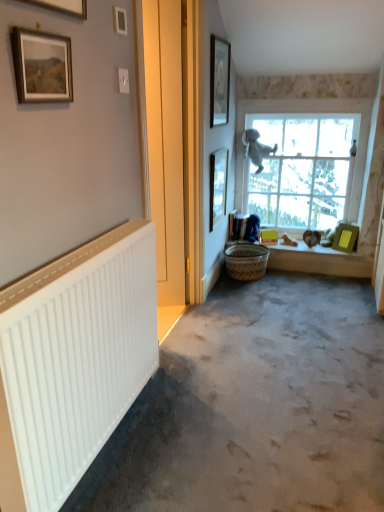
What do you see at coordinates (345, 237) in the screenshot? I see `green matte picture frame at right, which is counted as the sixth picture frame, starting from the front` at bounding box center [345, 237].

Describe the element at coordinates (64, 6) in the screenshot. I see `matte gold picture frame at upper left, marked as the first picture frame in a front-to-back arrangement` at that location.

What is the approximate height of matte gold picture frame at upper left, which ranks as the 1th picture frame in left-to-right order?

It is 11.10 inches.

Describe the element at coordinates (218, 185) in the screenshot. This screenshot has width=384, height=512. I see `matte black picture frame at right, which is the 5th picture frame from left to right` at that location.

From the picture: What is the approximate width of matte wooden picture frame at upper center, the 4th picture frame positioned from the front?

matte wooden picture frame at upper center, the 4th picture frame positioned from the front, is 0.93 inches in width.

Locate an element on the screen. Image resolution: width=384 pixels, height=512 pixels. white matte radiator at left is located at coordinates (255, 406).

Is wooden framed painting at upper left, which ranks as the fifth picture frame in right-to-left order, further to the viewer compared to matte wooden picture frame at upper center, which is the third picture frame from right to left?

No, wooden framed painting at upper left, which ranks as the fifth picture frame in right-to-left order, is closer to the camera.

From the image's perspective, would you say wooden framed painting at upper left, arranged as the 5th picture frame when viewed from the back, is shown under matte wooden picture frame at upper center, which is counted as the fourth picture frame, starting from the left?

Correct, wooden framed painting at upper left, arranged as the 5th picture frame when viewed from the back, appears lower than matte wooden picture frame at upper center, which is counted as the fourth picture frame, starting from the left, in the image.

Consider the image. Is wooden framed painting at upper left, which ranks as the fifth picture frame in right-to-left order, next to matte wooden picture frame at upper center, which is the third picture frame from right to left?

They are not placed beside each other.

Locate an element on the screen. The image size is (384, 512). the 2nd picture frame behind the wooden framed painting at upper left, positioned as the second picture frame in left-to-right order is located at coordinates (219, 81).

Can you confirm if matte black picture frame at right, which is the 5th picture frame from left to right, is wider than clear glass window at upper right?

No, matte black picture frame at right, which is the 5th picture frame from left to right, is not wider than clear glass window at upper right.

In the scene shown: Considering the relative sizes of matte black picture frame at right, positioned as the 2th picture frame in back-to-front order, and clear glass window at upper right in the image provided, is matte black picture frame at right, positioned as the 2th picture frame in back-to-front order, smaller than clear glass window at upper right?

Correct, matte black picture frame at right, positioned as the 2th picture frame in back-to-front order, occupies less space than clear glass window at upper right.

From the image's perspective, which object appears higher, matte black picture frame at right, the 5th picture frame positioned from the front, or clear glass window at upper right?

clear glass window at upper right, from the image's perspective.

In terms of height, does matte black picture frame at right, which appears as the 2th picture frame when viewed from the right, look taller or shorter compared to clear glass window at upper right?

Considering their sizes, matte black picture frame at right, which appears as the 2th picture frame when viewed from the right, has less height than clear glass window at upper right.

From the image's perspective, is matte black picture frame at right, the 5th picture frame positioned from the front, positioned above or below green matte picture frame at right, which ranks as the first picture frame in right-to-left order?

Based on their image positions, matte black picture frame at right, the 5th picture frame positioned from the front, is located above green matte picture frame at right, which ranks as the first picture frame in right-to-left order.

Which object is thinner, matte black picture frame at right, positioned as the 2th picture frame in back-to-front order, or green matte picture frame at right, marked as the sixth picture frame in a left-to-right arrangement?

Thinner between the two is matte black picture frame at right, positioned as the 2th picture frame in back-to-front order.

Which object is closer to the camera taking this photo, matte black picture frame at right, positioned as the 2th picture frame in back-to-front order, or green matte picture frame at right, which is counted as the sixth picture frame, starting from the front?

matte black picture frame at right, positioned as the 2th picture frame in back-to-front order.

Considering the relative sizes of matte black picture frame at right, which is the 5th picture frame from left to right, and green matte picture frame at right, which is counted as the sixth picture frame, starting from the front, in the image provided, is matte black picture frame at right, which is the 5th picture frame from left to right, taller than green matte picture frame at right, which is counted as the sixth picture frame, starting from the front,?

Correct, matte black picture frame at right, which is the 5th picture frame from left to right, is much taller as green matte picture frame at right, which is counted as the sixth picture frame, starting from the front.

Is green matte picture frame at right, positioned as the 1th picture frame in back-to-front order, wider or thinner than matte gold picture frame at upper left, the 6th picture frame viewed from the back?

Clearly, green matte picture frame at right, positioned as the 1th picture frame in back-to-front order, has more width compared to matte gold picture frame at upper left, the 6th picture frame viewed from the back.

Is green matte picture frame at right, positioned as the 1th picture frame in back-to-front order, inside or outside of matte gold picture frame at upper left, which ranks as the 1th picture frame in left-to-right order?

The correct answer is: outside.

Measure the distance from green matte picture frame at right, which is counted as the sixth picture frame, starting from the front, to matte gold picture frame at upper left, which ranks as the 1th picture frame in left-to-right order.

A distance of 8.87 feet exists between green matte picture frame at right, which is counted as the sixth picture frame, starting from the front, and matte gold picture frame at upper left, which ranks as the 1th picture frame in left-to-right order.

Is point (346, 246) farther from viewer compared to point (56, 4)?

That is True.

Can you confirm if matte wooden picture frame at upper center, which is the third picture frame from right to left, is shorter than matte white picture frame at upper center, acting as the 4th picture frame starting from the right?

Incorrect, the height of matte wooden picture frame at upper center, which is the third picture frame from right to left, does not fall short of that of matte white picture frame at upper center, acting as the 4th picture frame starting from the right.

Would you consider matte wooden picture frame at upper center, the 4th picture frame positioned from the front, to be distant from matte white picture frame at upper center, the 4th picture frame when ordered from back to front?

matte wooden picture frame at upper center, the 4th picture frame positioned from the front, is positioned a significant distance from matte white picture frame at upper center, the 4th picture frame when ordered from back to front.

Relative to matte white picture frame at upper center, the 4th picture frame when ordered from back to front, is matte wooden picture frame at upper center, which is the third picture frame from right to left, in front or behind?

In the image, matte wooden picture frame at upper center, which is the third picture frame from right to left, appears behind matte white picture frame at upper center, the 4th picture frame when ordered from back to front.

Does point (229, 66) appear closer or farther from the camera than point (123, 25)?

Point (229, 66) is farther from the camera than point (123, 25).

Which of these two, woven brown basket at lower center or matte black picture frame at right, positioned as the 2th picture frame in back-to-front order, stands shorter?

With less height is woven brown basket at lower center.

Is matte black picture frame at right, which is the 5th picture frame from left to right, located within woven brown basket at lower center?

No, matte black picture frame at right, which is the 5th picture frame from left to right, is not a part of woven brown basket at lower center.

Find the location of a particular element. The image size is (384, 512). the 1st picture frame in front of the woven brown basket at lower center is located at coordinates (218, 185).

Is woven brown basket at lower center with matte black picture frame at right, positioned as the 2th picture frame in back-to-front order?

No, woven brown basket at lower center is not with matte black picture frame at right, positioned as the 2th picture frame in back-to-front order.

Measure the distance between matte black picture frame at right, the 5th picture frame positioned from the front, and wooden framed painting at upper left, positioned as the second picture frame in left-to-right order.

6.56 feet.

Considering the positions of objects matte black picture frame at right, which appears as the 2th picture frame when viewed from the right, and wooden framed painting at upper left, the 2th picture frame from the front, in the image provided, who is in front, matte black picture frame at right, which appears as the 2th picture frame when viewed from the right, or wooden framed painting at upper left, the 2th picture frame from the front,?

wooden framed painting at upper left, the 2th picture frame from the front, is in front.

Is matte black picture frame at right, which appears as the 2th picture frame when viewed from the right, bigger than wooden framed painting at upper left, positioned as the second picture frame in left-to-right order?

Yes.

From a real-world perspective, is matte black picture frame at right, which appears as the 2th picture frame when viewed from the right, located beneath wooden framed painting at upper left, positioned as the second picture frame in left-to-right order?

Yes, from a real-world perspective, matte black picture frame at right, which appears as the 2th picture frame when viewed from the right, is below wooden framed painting at upper left, positioned as the second picture frame in left-to-right order.

From the wooden framed painting at upper left, arranged as the 5th picture frame when viewed from the back, count 2nd picture frame to the right and point to it. Please provide its 2D coordinates.

[(219, 81)]

Find the location of a particular element. window above the matte black picture frame at right, positioned as the 2th picture frame in back-to-front order (from the image's perspective) is located at coordinates (304, 161).

Based on their spatial positions, is matte white picture frame at upper center, the 3th picture frame when ordered from front to back, or matte black picture frame at right, positioned as the 2th picture frame in back-to-front order, further from matte gold picture frame at upper left, which ranks as the 1th picture frame in left-to-right order?

matte black picture frame at right, positioned as the 2th picture frame in back-to-front order, lies further to matte gold picture frame at upper left, which ranks as the 1th picture frame in left-to-right order, than the other object.

Looking at the image, which one is located further to matte white picture frame at upper center, which is the 3th picture frame in left-to-right order, white plastic radiator at left or green matte picture frame at right, which is counted as the sixth picture frame, starting from the front?

Among the two, green matte picture frame at right, which is counted as the sixth picture frame, starting from the front, is located further to matte white picture frame at upper center, which is the 3th picture frame in left-to-right order.

Considering their positions, is white plastic radiator at left positioned further to clear glass window at upper right than matte white picture frame at upper center, the 4th picture frame when ordered from back to front?

white plastic radiator at left.

Based on their spatial positions, is clear glass window at upper right or white smooth door at center further from white plastic radiator at left?

clear glass window at upper right is further to white plastic radiator at left.

From the image, which object appears to be nearer to woven brown basket at lower center, white plastic radiator at left or matte gold picture frame at upper left, the 6th picture frame viewed from the back?

white plastic radiator at left is positioned closer to the anchor woven brown basket at lower center.

Looking at this image, when comparing their distances from white plastic radiator at left, does clear glass window at upper right or white matte radiator at left seem further?

The object further to white plastic radiator at left is clear glass window at upper right.

When comparing their distances from white matte radiator at left, does matte gold picture frame at upper left, the 6th picture frame when ordered from right to left, or matte white picture frame at upper center, the 3th picture frame when ordered from front to back, seem closer?

matte white picture frame at upper center, the 3th picture frame when ordered from front to back, is positioned closer to the anchor white matte radiator at left.

Which object lies nearer to the anchor point matte black picture frame at right, positioned as the 2th picture frame in back-to-front order, white smooth door at center or green matte picture frame at right, which is counted as the sixth picture frame, starting from the front?

Among the two, white smooth door at center is located nearer to matte black picture frame at right, positioned as the 2th picture frame in back-to-front order.

You are a GUI agent. You are given a task and a screenshot of the screen. Output one action in this format:
    pyautogui.click(x=<x>, y=<y>)
    Task: Click on the basket between white smooth door at center and clear glass window at upper right
    The image size is (384, 512).
    Given the screenshot: What is the action you would take?
    pyautogui.click(x=246, y=261)

Where is `window positioned between matte white picture frame at upper center, acting as the 4th picture frame starting from the right, and woven brown basket at lower center from near to far`? The image size is (384, 512). window positioned between matte white picture frame at upper center, acting as the 4th picture frame starting from the right, and woven brown basket at lower center from near to far is located at coordinates (304, 161).

You are a GUI agent. You are given a task and a screenshot of the screen. Output one action in this format:
    pyautogui.click(x=<x>, y=<y>)
    Task: Click on the picture frame located between matte wooden picture frame at upper center, which is the third picture frame from right to left, and green matte picture frame at right, marked as the sixth picture frame in a left-to-right arrangement, in the left-right direction
    The width and height of the screenshot is (384, 512).
    Given the screenshot: What is the action you would take?
    pyautogui.click(x=218, y=185)

Locate an element on the screen. concrete between white plastic radiator at left and woven brown basket at lower center along the z-axis is located at coordinates (255, 406).